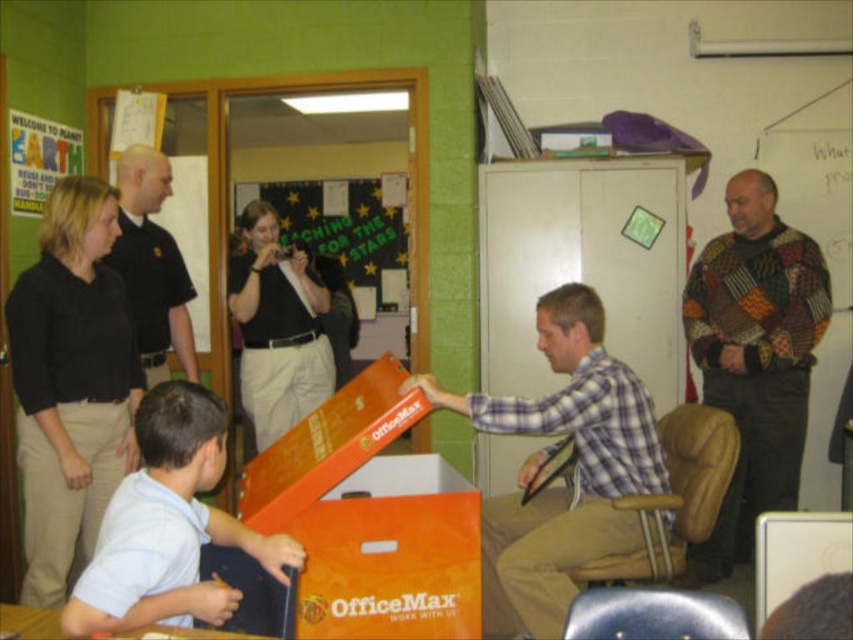
Question: Which point is farther from the camera taking this photo?

Choices:
 (A) (352, 508)
 (B) (392, 205)
 (C) (161, 152)

Answer: (B)

Question: Which point appears farthest from the camera in this image?

Choices:
 (A) (637, 406)
 (B) (154, 269)

Answer: (B)

Question: Is plaid shirt at center closer to the viewer compared to light blue shirt at lower left?

Choices:
 (A) no
 (B) yes

Answer: (A)

Question: Can you confirm if black matte shirt at left is positioned below patchwork sweater at right?

Choices:
 (A) yes
 (B) no

Answer: (B)

Question: Which of the following is the closest to the observer?

Choices:
 (A) (543, 625)
 (B) (140, 145)
 (C) (346, 259)

Answer: (A)

Question: Can you confirm if orange cardboard box at center is thinner than plaid shirt at center?

Choices:
 (A) no
 (B) yes

Answer: (B)